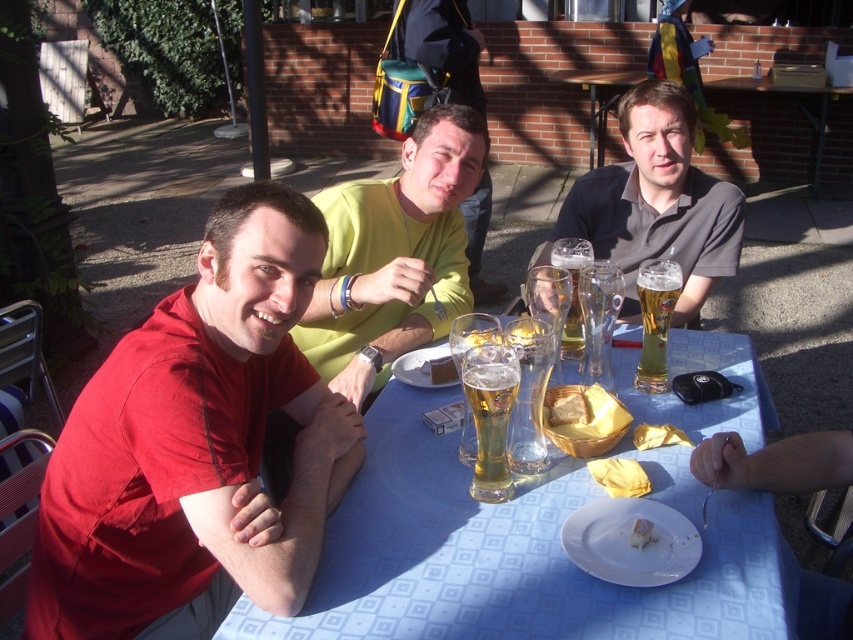
Question: Among these points, which one is farthest from the camera?

Choices:
 (A) (567, 250)
 (B) (445, 381)
 (C) (132, 481)

Answer: (A)

Question: Considering the relative positions of translucent glass beer at center and white creamy cake at lower center in the image provided, where is translucent glass beer at center located with respect to white creamy cake at lower center?

Choices:
 (A) below
 (B) above

Answer: (B)

Question: Which point is farther from the camera taking this photo?

Choices:
 (A) (405, 545)
 (B) (641, 522)

Answer: (A)

Question: Does matte yellow shirt at center appear on the right side of blue fabric picnic table at upper center?

Choices:
 (A) no
 (B) yes

Answer: (A)

Question: Does translucent glass beer at center have a larger size compared to white creamy cake at lower center?

Choices:
 (A) yes
 (B) no

Answer: (A)

Question: Which of the following is the farthest from the observer?

Choices:
 (A) blue fabric picnic table at upper center
 (B) blue fabric table at center
 (C) clear glass beer at center

Answer: (A)